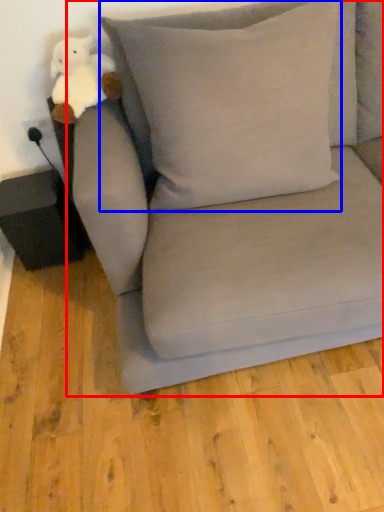
Question: Which point is closer to the camera, studio couch (highlighted by a red box) or pillow (highlighted by a blue box)?

Choices:
 (A) studio couch
 (B) pillow

Answer: (A)